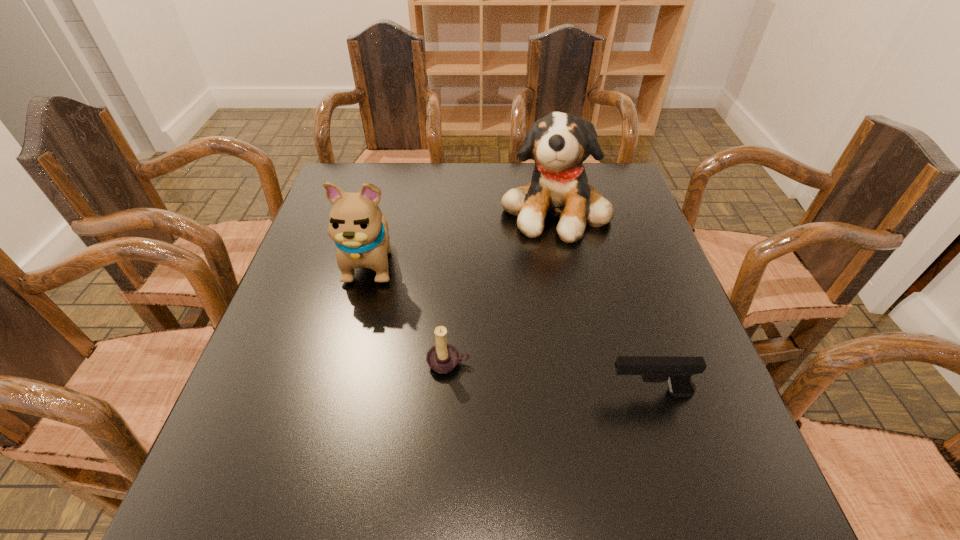
In order to click on free space between the right puppy and the leftmost object in this screenshot , I will do `click(464, 235)`.

The width and height of the screenshot is (960, 540). I want to click on vacant area between the second nearest object and the left puppy, so click(410, 312).

This screenshot has width=960, height=540. Identify the location of object that stands as the second closest to the pistol. (559, 143).

At what (x,y) coordinates should I click in order to perform the action: click on object identified as the third closest to the pistol. Please return your answer as a coordinate pair (x, y). Image resolution: width=960 pixels, height=540 pixels. Looking at the image, I should click on (356, 224).